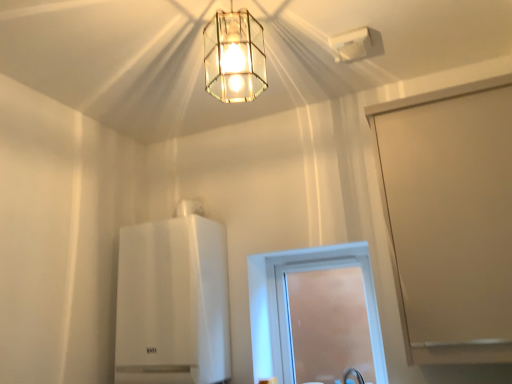
Question: Which direction should I rotate to look at clear glass pendant light at upper center, placed as the first lamp when sorted from left to right, — up or down?

Choices:
 (A) down
 (B) up

Answer: (B)

Question: Considering the relative sizes of white glossy boiler at center and white plastic air vent at upper center, placed as the second lamp when sorted from front to back, in the image provided, is white glossy boiler at center wider than white plastic air vent at upper center, placed as the second lamp when sorted from front to back,?

Choices:
 (A) yes
 (B) no

Answer: (A)

Question: Is white plastic air vent at upper center, placed as the 1th lamp when sorted from right to left, a part of white glossy boiler at center?

Choices:
 (A) yes
 (B) no

Answer: (B)

Question: Is white glossy boiler at center to the left of white plastic air vent at upper center, arranged as the 2th lamp when viewed from the left, from the viewer's perspective?

Choices:
 (A) no
 (B) yes

Answer: (B)

Question: Does white glossy boiler at center lie in front of white plastic air vent at upper center, which is the first lamp from back to front?

Choices:
 (A) yes
 (B) no

Answer: (B)

Question: Can you confirm if white glossy boiler at center is smaller than white plastic air vent at upper center, placed as the 1th lamp when sorted from right to left?

Choices:
 (A) no
 (B) yes

Answer: (A)

Question: From the image's perspective, is white glossy boiler at center beneath white plastic air vent at upper center, which is the first lamp from back to front?

Choices:
 (A) yes
 (B) no

Answer: (A)

Question: Is clear glass window at center to the left of beige matte screen door at right from the viewer's perspective?

Choices:
 (A) no
 (B) yes

Answer: (B)

Question: From a real-world perspective, is clear glass window at center located higher than beige matte screen door at right?

Choices:
 (A) yes
 (B) no

Answer: (B)

Question: From the image's perspective, is clear glass window at center over beige matte screen door at right?

Choices:
 (A) no
 (B) yes

Answer: (A)

Question: Is clear glass window at center closer to camera compared to beige matte screen door at right?

Choices:
 (A) no
 (B) yes

Answer: (A)

Question: Does clear glass window at center have a lesser width compared to beige matte screen door at right?

Choices:
 (A) yes
 (B) no

Answer: (A)

Question: Is clear glass window at center shorter than beige matte screen door at right?

Choices:
 (A) no
 (B) yes

Answer: (B)

Question: From the image's perspective, is clear glass window at center over white plastic air vent at upper center, arranged as the 2th lamp when viewed from the left?

Choices:
 (A) no
 (B) yes

Answer: (A)